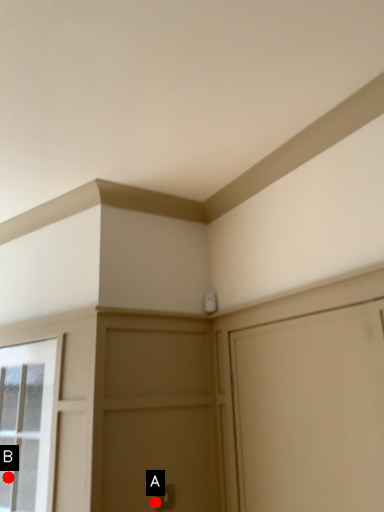
Question: Two points are circled on the image, labeled by A and B beside each circle. Which point is farther from the camera taking this photo?

Choices:
 (A) A is further
 (B) B is further

Answer: (B)